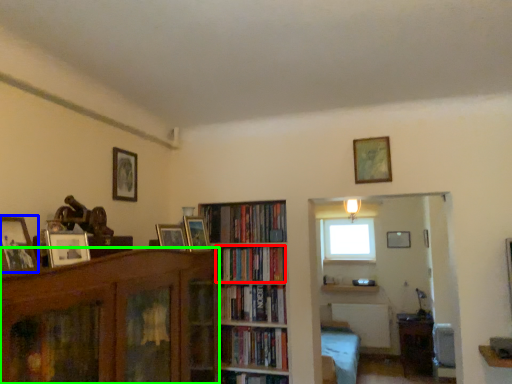
Question: Which is farther away from book (highlighted by a red box)? picture frame (highlighted by a blue box) or bookcase (highlighted by a green box)?

Choices:
 (A) picture frame
 (B) bookcase

Answer: (A)